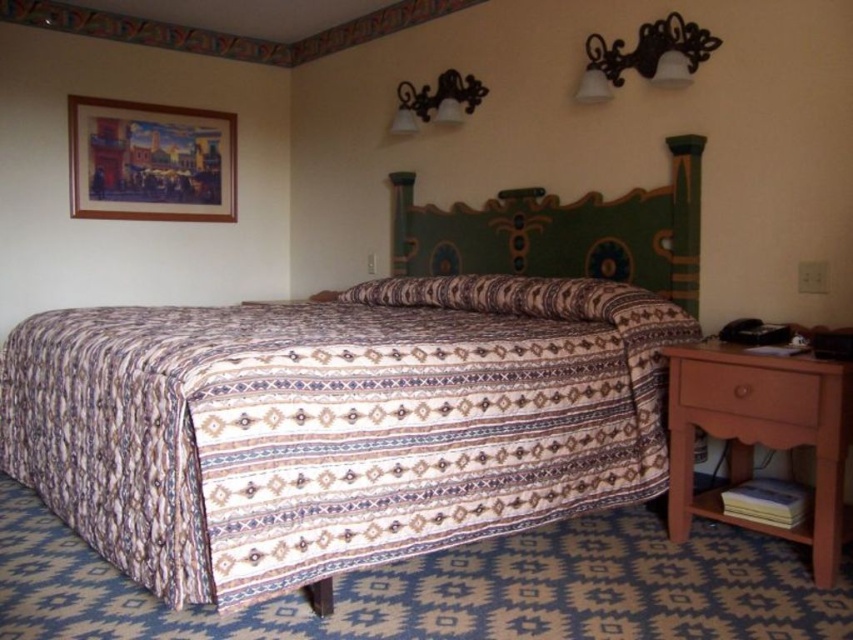
Question: Estimate the real-world distances between objects in this image. Which object is farther from the matte black sconce at upper center?

Choices:
 (A) light brown wood nightstand at lower right
 (B) black metal sconce at upper center
 (C) brown wood drawer at lower right
 (D) patterned fabric bed at center

Answer: (C)

Question: Which point appears farthest from the camera in this image?

Choices:
 (A) (792, 404)
 (B) (120, 384)
 (C) (729, 401)

Answer: (C)

Question: Can you confirm if green painted wood headboard at upper center is positioned above light brown wood nightstand at lower right?

Choices:
 (A) no
 (B) yes

Answer: (B)

Question: Among these objects, which one is farthest from the camera?

Choices:
 (A) matte black sconce at upper center
 (B) brown wood drawer at lower right

Answer: (A)

Question: Does light brown wood nightstand at lower right have a larger size compared to matte black sconce at upper center?

Choices:
 (A) yes
 (B) no

Answer: (A)

Question: Is brown wood drawer at lower right thinner than matte black sconce at upper center?

Choices:
 (A) yes
 (B) no

Answer: (A)